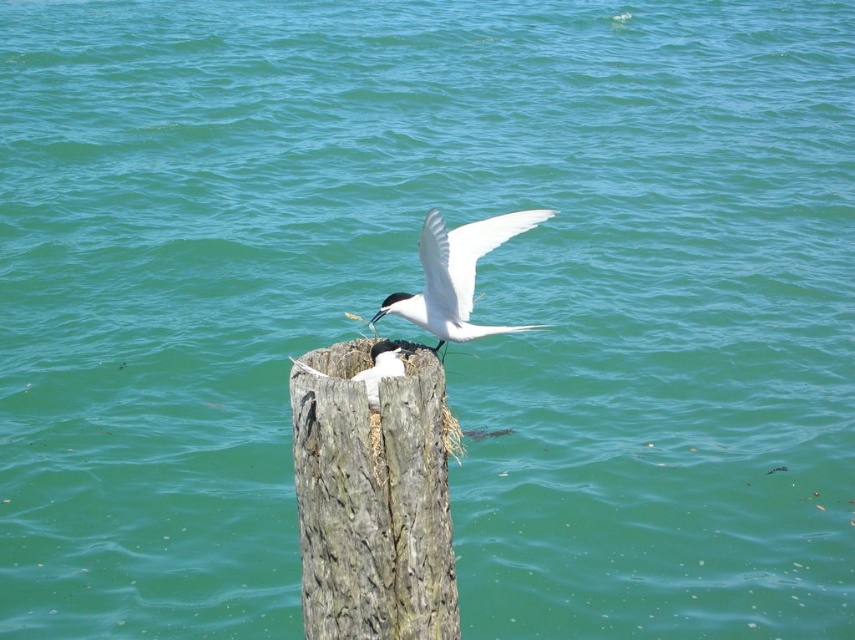
You are standing on the wooden post and looking towards the water. You see two points marked on the post. One is at point (396, 557) and the other at point (532, 224). Which point is closer to you?

Point (396, 557) is in front of point 0.350, 0.23, so it is closer to you.

You are a birdwatcher observing the scene. You notice the weathered wood stump at center and the white glossy bird at center. Which object is bigger in size?

The weathered wood stump at center is larger in size than the white glossy bird at center.

You are a photographer trying to capture a closeup of the white glossy bird at center. You notice the weathered wood stump at center is blocking your view. Can you estimate whether the stump is wider or narrower than the bird?

The weathered wood stump at center has a lesser width compared to white glossy bird at center, so the stump is narrower than the bird. Therefore, it might not fully block the view, allowing for a possible closeup shot.